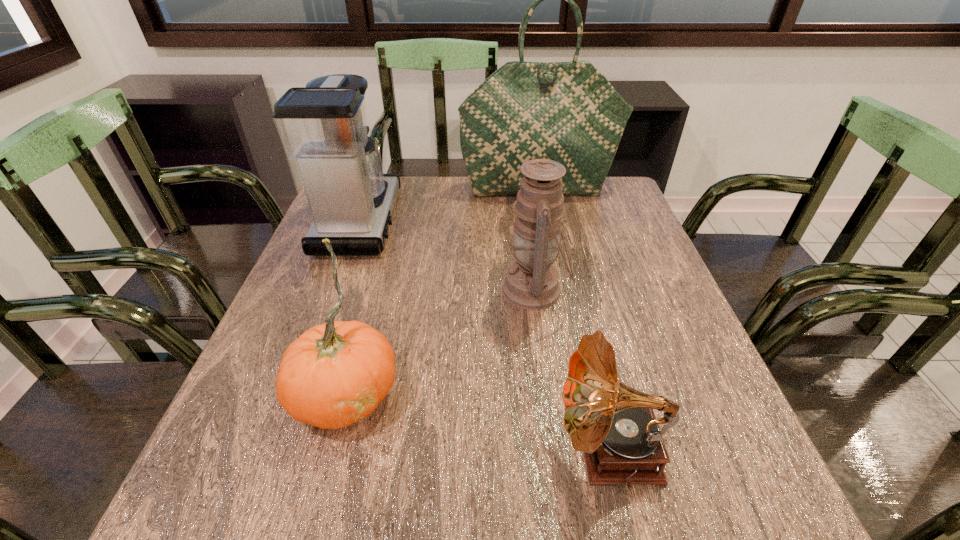
At what (x,y) coordinates should I click in order to perform the action: click on the tallest object. Please return your answer as a coordinate pair (x, y). Image resolution: width=960 pixels, height=540 pixels. Looking at the image, I should click on (568, 112).

Locate an element on the screen. coffee maker is located at coordinates (323, 127).

The height and width of the screenshot is (540, 960). In order to click on oil lamp in this screenshot , I will do `click(531, 282)`.

At what (x,y) coordinates should I click in order to perform the action: click on pumpkin. Please return your answer as a coordinate pair (x, y). The width and height of the screenshot is (960, 540). Looking at the image, I should click on (334, 374).

The image size is (960, 540). I want to click on phonograph_record, so click(614, 424).

Where is `vacant position located on the left of the tallest object`? Image resolution: width=960 pixels, height=540 pixels. vacant position located on the left of the tallest object is located at coordinates (384, 188).

At what (x,y) coordinates should I click in order to perform the action: click on vacant space located 0.080m at the front of the fourth shortest object where the controls are located. Please return your answer as a coordinate pair (x, y). The height and width of the screenshot is (540, 960). Looking at the image, I should click on (426, 222).

At what (x,y) coordinates should I click in order to perform the action: click on vacant space located 0.270m on the back of the oil lamp. Please return your answer as a coordinate pair (x, y). Image resolution: width=960 pixels, height=540 pixels. Looking at the image, I should click on (522, 202).

You are a GUI agent. You are given a task and a screenshot of the screen. Output one action in this format:
    pyautogui.click(x=<x>, y=<y>)
    Task: Click on the free space located 0.100m on the front of the pumpkin
    This screenshot has width=960, height=540.
    Given the screenshot: What is the action you would take?
    pyautogui.click(x=315, y=511)

Where is `free point located 0.290m on the horn of the phonograph_record`? free point located 0.290m on the horn of the phonograph_record is located at coordinates point(376,449).